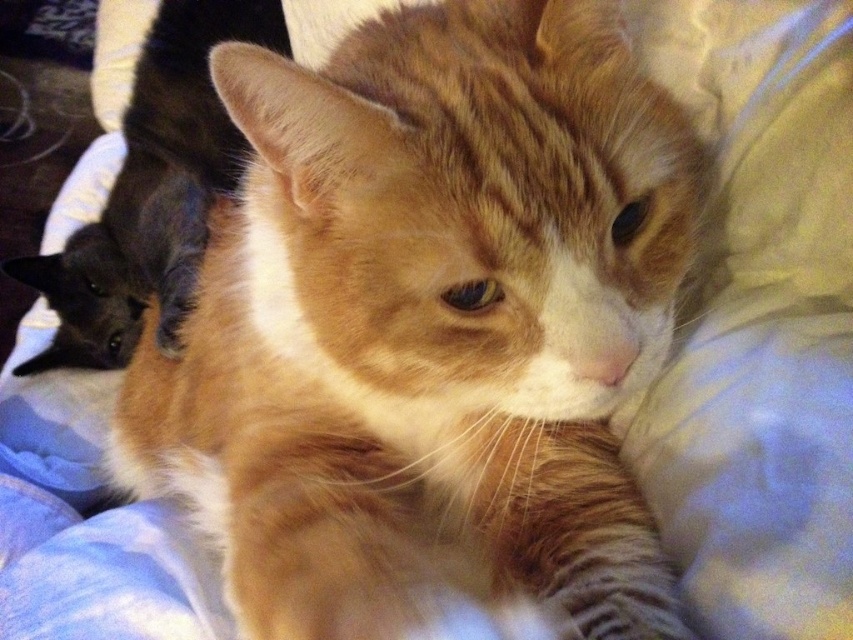
You are a photographer trying to capture a clear photo of the orange tabby cat at center and the black glossy cat at left. Which cat is blocking the view of the other?

The orange tabby cat at center is positioned under the black glossy cat at left, so the black glossy cat at left is blocking the view of the orange tabby cat at center.

You are a photographer trying to capture a photo of both cats. Since the orange tabby cat at center is blocking the black glossy cat at left, which cat should you move to get a clear shot of both?

The orange tabby cat at center is blocking the black glossy cat at left. Since the orange tabby cat at center is shorter than the black glossy cat at left, you should move the orange tabby cat at center to allow the taller black glossy cat at left to be visible.